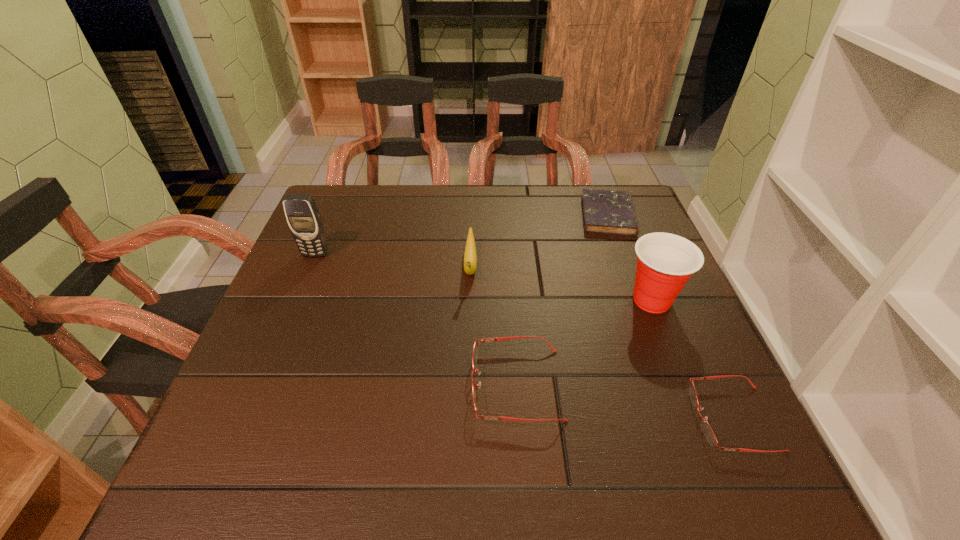
Please point a vacant point for placing a spectacles on the left. Please provide its 2D coordinates. Your answer should be formatted as a tuple, i.e. [(x, y)], where the tuple contains the x and y coordinates of a point satisfying the conditions above.

[(325, 355)]